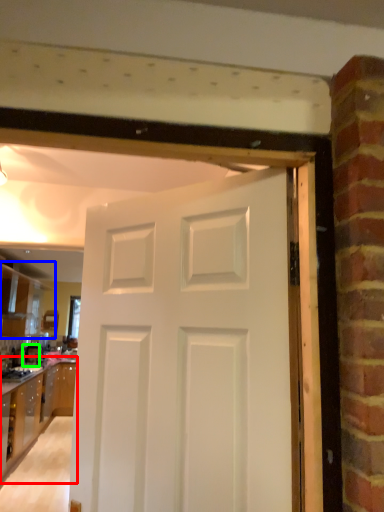
Question: Estimate the real-world distances between objects in this image. Which object is closer to cabinetry (highlighted by a red box), cabinetry (highlighted by a blue box) or appliance (highlighted by a green box)?

Choices:
 (A) cabinetry
 (B) appliance

Answer: (B)